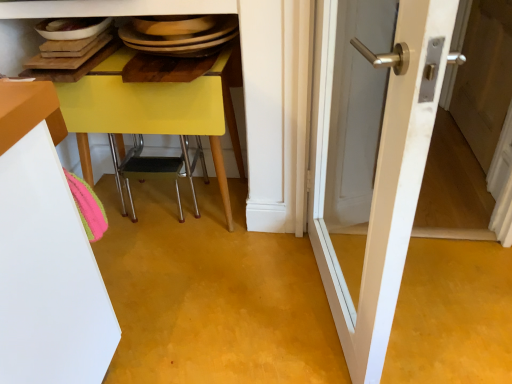
The height and width of the screenshot is (384, 512). What do you see at coordinates (484, 77) in the screenshot?
I see `white wood screen door at right` at bounding box center [484, 77].

Where is `white glossy door at center`? The width and height of the screenshot is (512, 384). white glossy door at center is located at coordinates (379, 176).

Considering the relative sizes of white glossy door at center and white wood screen door at right in the image provided, is white glossy door at center shorter than white wood screen door at right?

No.

Would you say white glossy door at center contains white wood screen door at right?

No, white wood screen door at right is not a part of white glossy door at center.

Which is behind, white glossy door at center or white wood screen door at right?

white wood screen door at right is further away from the camera.

Does white glossy door at center appear on the right side of white wood screen door at right?

In fact, white glossy door at center is to the left of white wood screen door at right.

From the image's perspective, which is above, white wood screen door at right or yellow plastic chair at lower center?

white wood screen door at right is shown above in the image.

Which of these two, white wood screen door at right or yellow plastic chair at lower center, is smaller?

white wood screen door at right.

Is yellow plastic chair at lower center completely or partially inside white wood screen door at right?

No, yellow plastic chair at lower center is not inside white wood screen door at right.

Which is farther, [464,42] or [85,155]?

The point [464,42] is more distant.

Considering the positions of objects white glossy door at center and yellow plastic chair at lower center in the image provided, who is more to the right, white glossy door at center or yellow plastic chair at lower center?

Positioned to the right is white glossy door at center.

Considering the relative sizes of white glossy door at center and yellow plastic chair at lower center in the image provided, is white glossy door at center wider than yellow plastic chair at lower center?

No.

Is white glossy door at center outside of yellow plastic chair at lower center?

Indeed, white glossy door at center is completely outside yellow plastic chair at lower center.

From their relative heights in the image, would you say white glossy door at center is taller or shorter than yellow plastic chair at lower center?

Clearly, white glossy door at center is taller compared to yellow plastic chair at lower center.

From a real-world perspective, is white wood screen door at right on white glossy door at center?

No, from a real-world perspective, white wood screen door at right is not on top of white glossy door at center.

Can you tell me how much white wood screen door at right and white glossy door at center differ in facing direction?

white wood screen door at right and white glossy door at center are facing 170 degrees away from each other.

Which is more to the right, white wood screen door at right or white glossy door at center?

white wood screen door at right is more to the right.

Considering the relative sizes of white wood screen door at right and white glossy door at center in the image provided, is white wood screen door at right thinner than white glossy door at center?

Yes.

You are a GUI agent. You are given a task and a screenshot of the screen. Output one action in this format:
    pyautogui.click(x=<x>, y=<y>)
    Task: Click on the door that is on the right side of yellow plastic chair at lower center
    The height and width of the screenshot is (384, 512).
    Given the screenshot: What is the action you would take?
    pyautogui.click(x=379, y=176)

Does yellow plastic chair at lower center come in front of white glossy door at center?

No, yellow plastic chair at lower center is further to the viewer.

Is yellow plastic chair at lower center positioned with its back to white glossy door at center?

No, white glossy door at center is not at the back of yellow plastic chair at lower center.

Is yellow plastic chair at lower center bigger or smaller than white glossy door at center?

In the image, yellow plastic chair at lower center appears to be larger than white glossy door at center.

Is yellow plastic chair at lower center not within white wood screen door at right?

That's correct, yellow plastic chair at lower center is outside of white wood screen door at right.

How different are the orientations of yellow plastic chair at lower center and white wood screen door at right in degrees?

They differ by 89.7 degrees in their facing directions.

Considering the sizes of objects yellow plastic chair at lower center and white wood screen door at right in the image provided, who is bigger, yellow plastic chair at lower center or white wood screen door at right?

yellow plastic chair at lower center.

Is point (181, 124) farther from camera compared to point (509, 34)?

No, (181, 124) is closer to viewer.

Find the location of a particular element. This screenshot has width=512, height=384. screen door lying above the white glossy door at center (from the image's perspective) is located at coordinates (484, 77).

Where is `table that appears on the left of white wood screen door at right`? This screenshot has height=384, width=512. table that appears on the left of white wood screen door at right is located at coordinates (146, 114).

From the picture: From the image, which object appears to be nearer to yellow plastic chair at lower center, white glossy door at center or white wood screen door at right?

white glossy door at center is positioned closer to the anchor yellow plastic chair at lower center.

When comparing their distances from white wood screen door at right, does white glossy door at center or yellow plastic chair at lower center seem closer?

white glossy door at center lies closer to white wood screen door at right than the other object.

Estimate the real-world distances between objects in this image. Which object is closer to white glossy door at center, yellow plastic chair at lower center or white wood screen door at right?

Among the two, yellow plastic chair at lower center is located nearer to white glossy door at center.

Looking at the image, which one is located closer to white wood screen door at right, yellow plastic chair at lower center or white glossy door at center?

Among the two, white glossy door at center is located nearer to white wood screen door at right.

When comparing their distances from yellow plastic chair at lower center, does white wood screen door at right or white glossy door at center seem closer?

white glossy door at center is closer to yellow plastic chair at lower center.

Consider the image. When comparing their distances from white glossy door at center, does white wood screen door at right or yellow plastic chair at lower center seem closer?

The object closer to white glossy door at center is yellow plastic chair at lower center.

Identify the location of door located between yellow plastic chair at lower center and white wood screen door at right in the left-right direction. (379, 176).